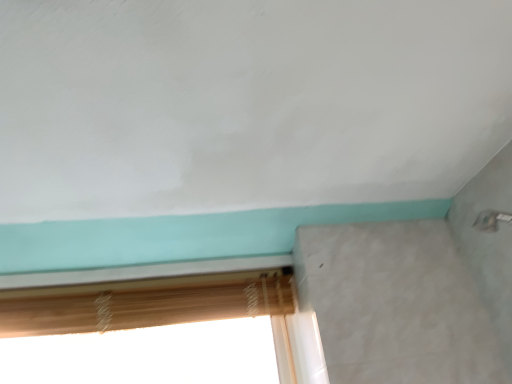
Describe the element at coordinates (174, 311) in the screenshot. I see `wooden blind at lower left` at that location.

In order to face wooden blind at lower left, should I rotate leftwards or rightwards?

A 13.598 degree turn to the left will do.

Where is `wooden blind at lower left`? The height and width of the screenshot is (384, 512). wooden blind at lower left is located at coordinates (174, 311).

Find the location of a particular element. The image size is (512, 384). wooden blind at lower left is located at coordinates (174, 311).